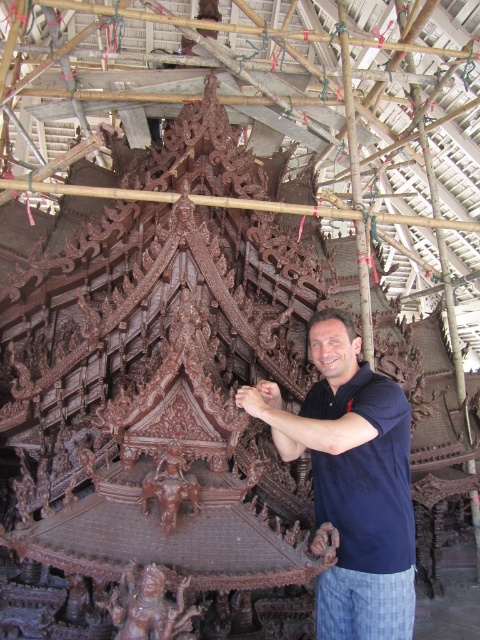
Is dark brown wood at left above brown carved elephant at center?

No.

Is point (340, 520) closer to camera compared to point (144, 484)?

No, it is not.

Find the location of a particular element. dark brown wood at left is located at coordinates (351, 481).

Between point (335, 387) and point (132, 608), which one is positioned behind?

The point (335, 387) is behind.

From the picture: Does dark brown wood at left come in front of brown carved statue at lower center?

That is False.

Between point (368, 580) and point (143, 572), which one is positioned behind?

Point (368, 580)

The width and height of the screenshot is (480, 640). I want to click on dark brown wood at left, so click(351, 481).

Does brown carved statue at lower center have a lesser width compared to brown carved elephant at center?

No, brown carved statue at lower center is not thinner than brown carved elephant at center.

Is brown carved statue at lower center smaller than brown carved elephant at center?

No.

Where is `brown carved statue at lower center`? This screenshot has height=640, width=480. brown carved statue at lower center is located at coordinates (148, 605).